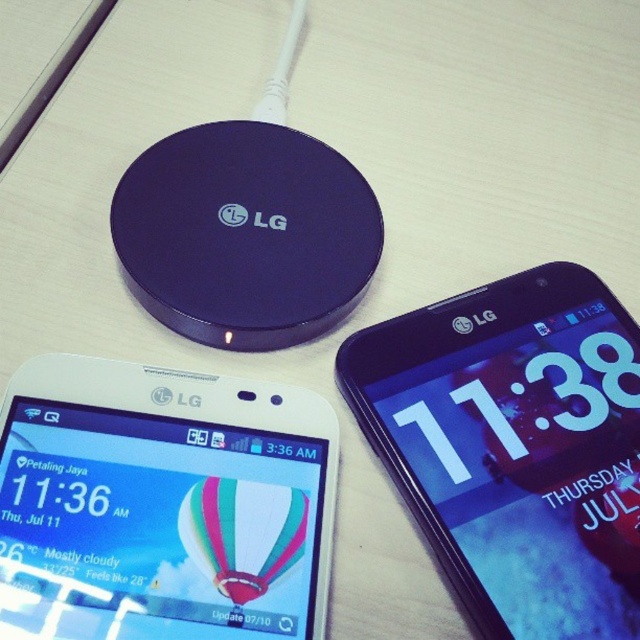
Is point (602, 324) behind point (339, 285)?

No, (602, 324) is in front of (339, 285).

Does black glossy smartphone at upper right have a greater height compared to purple glossy lg wireless charger at upper center?

No, black glossy smartphone at upper right is not taller than purple glossy lg wireless charger at upper center.

Which is behind, point (492, 486) or point (152, 221)?

Positioned behind is point (152, 221).

I want to click on black glossy smartphone at upper right, so click(515, 445).

Does white glossy phone at lower left have a greater width compared to purple glossy lg wireless charger at upper center?

Indeed, white glossy phone at lower left has a greater width compared to purple glossy lg wireless charger at upper center.

Is white glossy phone at lower left taller than purple glossy lg wireless charger at upper center?

No.

Identify the location of white glossy phone at lower left. (163, 504).

You are a GUI agent. You are given a task and a screenshot of the screen. Output one action in this format:
    pyautogui.click(x=<x>, y=<y>)
    Task: Click on the white glossy phone at lower left
    Image resolution: width=640 pixels, height=640 pixels.
    Given the screenshot: What is the action you would take?
    pyautogui.click(x=163, y=504)

Between white glossy phone at lower left and black glossy smartphone at upper right, which one appears on the left side from the viewer's perspective?

Positioned to the left is white glossy phone at lower left.

What do you see at coordinates (163, 504) in the screenshot? I see `white glossy phone at lower left` at bounding box center [163, 504].

I want to click on white glossy phone at lower left, so [163, 504].